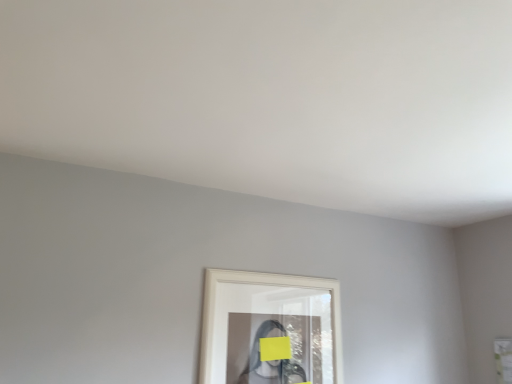
Question: Should I look upward or downward to see white glossy picture frame at lower center?

Choices:
 (A) up
 (B) down

Answer: (B)